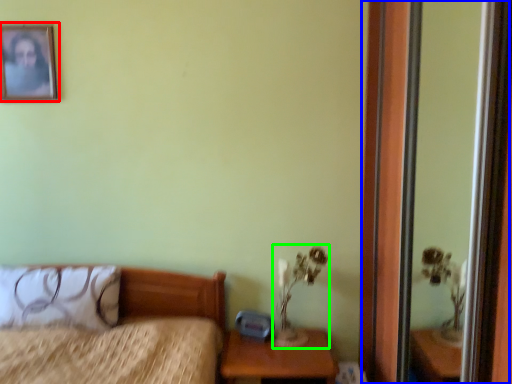
Question: Based on their relative distances, which object is nearer to picture frame (highlighted by a red box)? Choose from screen door (highlighted by a blue box) and table lamp (highlighted by a green box).

Choices:
 (A) screen door
 (B) table lamp

Answer: (B)